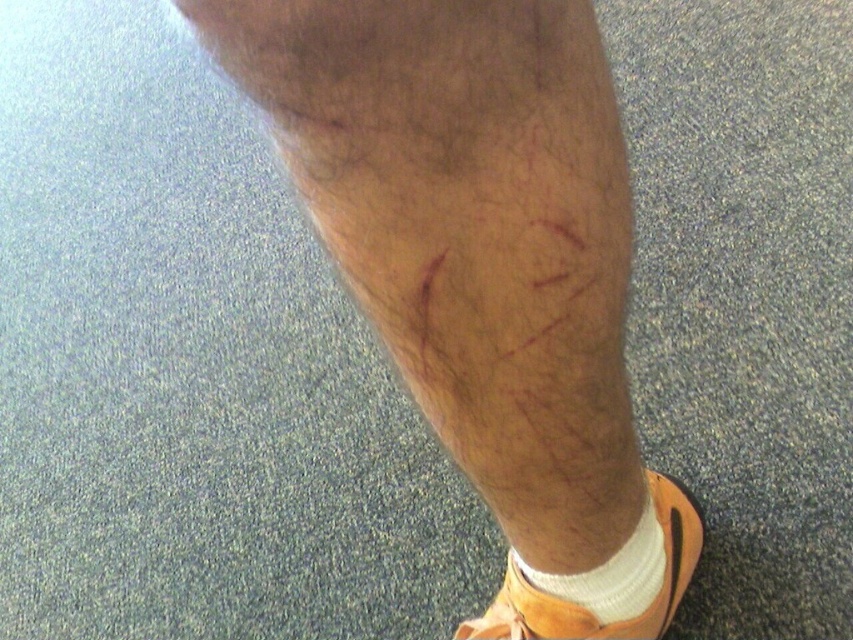
You are a medical professional examining a patient. You notice two points on their leg marked as point 1 at coordinates (383, 29) and point 2 at (622, 627). Which point is closer to the patient?

Point 1 at coordinates (383, 29) is closer to the patient because it is in front of point 2 at (622, 627).

You are a fashion designer creating a new line of footwear. You have an orange leather sandal at lower right and a white soft sock at lower right. Which one is bigger in size?

The orange leather sandal at lower right is larger in size than the white soft sock at lower right.